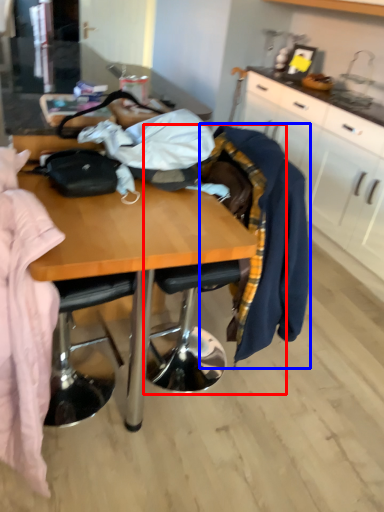
Question: Which object appears closest to the camera in this image, chair (highlighted by a red box) or clothing (highlighted by a blue box)?

Choices:
 (A) chair
 (B) clothing

Answer: (A)